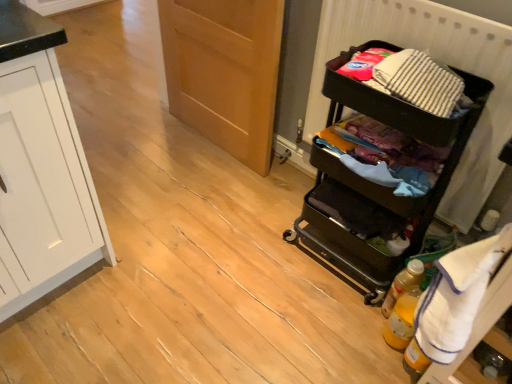
Identify the location of unoccupied area in front of black plastic cart at right. (327, 323).